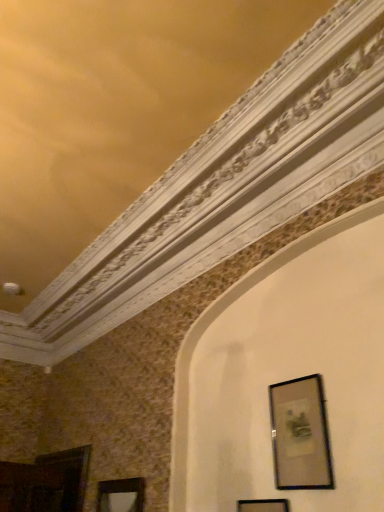
Question: From the image's perspective, is black matte picture frame at lower right, the 2th picture frame positioned from the right, on top of matte black picture frame at lower right, which appears as the first picture frame when viewed from the right?

Choices:
 (A) yes
 (B) no

Answer: (B)

Question: Is black matte picture frame at lower right, which is counted as the 2th picture frame, starting from the left, wider than matte black picture frame at lower right, which appears as the first picture frame when viewed from the right?

Choices:
 (A) yes
 (B) no

Answer: (A)

Question: Does black matte picture frame at lower right, the 2th picture frame positioned from the right, appear on the right side of matte black picture frame at lower right, which appears as the first picture frame when viewed from the right?

Choices:
 (A) yes
 (B) no

Answer: (B)

Question: Is black matte picture frame at lower right, the 2th picture frame positioned from the right, at the left side of matte black picture frame at lower right, the third picture frame in the left-to-right sequence?

Choices:
 (A) no
 (B) yes

Answer: (B)

Question: Does black matte picture frame at lower right, placed as the 1th picture frame when sorted from front to back, have a lesser height compared to matte black picture frame at lower right, which appears as the first picture frame when viewed from the right?

Choices:
 (A) no
 (B) yes

Answer: (A)

Question: Considering the positions of matte black picture frame at lower right, which ranks as the second picture frame in front-to-back order, and black matte picture frame at lower right, placed as the third picture frame when sorted from back to front, in the image, is matte black picture frame at lower right, which ranks as the second picture frame in front-to-back order, wider or thinner than black matte picture frame at lower right, placed as the third picture frame when sorted from back to front,?

Choices:
 (A) wide
 (B) thin

Answer: (B)

Question: Choose the correct answer: Is matte black picture frame at lower right, which ranks as the second picture frame in back-to-front order, inside black matte picture frame at lower right, the 2th picture frame positioned from the right, or outside it?

Choices:
 (A) inside
 (B) outside

Answer: (B)

Question: From a real-world perspective, relative to black matte picture frame at lower right, which is counted as the 2th picture frame, starting from the left, is matte black picture frame at lower right, which appears as the first picture frame when viewed from the right, vertically above or below?

Choices:
 (A) below
 (B) above

Answer: (B)

Question: Based on their sizes in the image, would you say matte black picture frame at lower right, the third picture frame in the left-to-right sequence, is bigger or smaller than black matte picture frame at lower right, placed as the third picture frame when sorted from back to front?

Choices:
 (A) small
 (B) big

Answer: (A)

Question: Is black matte picture frame at lower right, placed as the 1th picture frame when sorted from front to back, inside the boundaries of matte black picture frame at lower left, the first picture frame viewed from the back, or outside?

Choices:
 (A) outside
 (B) inside

Answer: (A)

Question: From a real-world perspective, relative to matte black picture frame at lower left, arranged as the third picture frame when viewed from the right, is black matte picture frame at lower right, which is counted as the 2th picture frame, starting from the left, vertically above or below?

Choices:
 (A) below
 (B) above

Answer: (A)

Question: Is black matte picture frame at lower right, placed as the 1th picture frame when sorted from front to back, in front of or behind matte black picture frame at lower left, arranged as the third picture frame when viewed from the right, in the image?

Choices:
 (A) front
 (B) behind

Answer: (A)

Question: Considering the positions of black matte picture frame at lower right, the 2th picture frame positioned from the right, and matte black picture frame at lower left, arranged as the third picture frame when viewed from the right, in the image, is black matte picture frame at lower right, the 2th picture frame positioned from the right, wider or thinner than matte black picture frame at lower left, arranged as the third picture frame when viewed from the right,?

Choices:
 (A) thin
 (B) wide

Answer: (A)

Question: From a real-world perspective, is black matte picture frame at lower right, which is counted as the 2th picture frame, starting from the left, positioned above or below matte black picture frame at lower right, which ranks as the second picture frame in front-to-back order?

Choices:
 (A) above
 (B) below

Answer: (B)

Question: Is point (240, 506) closer or farther from the camera than point (327, 453)?

Choices:
 (A) closer
 (B) farther

Answer: (B)